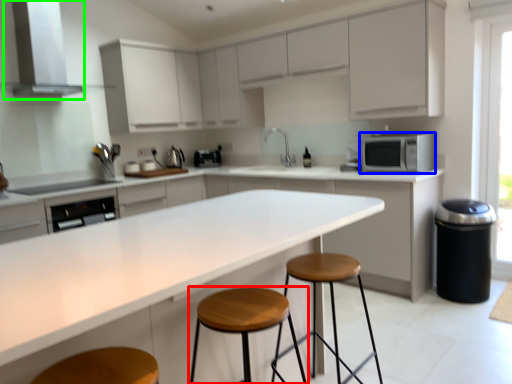
Question: Which object is the closest to the stool (highlighted by a red box)? Choose among these: microwave oven (highlighted by a blue box) or exhaust hood (highlighted by a green box).

Choices:
 (A) microwave oven
 (B) exhaust hood

Answer: (A)